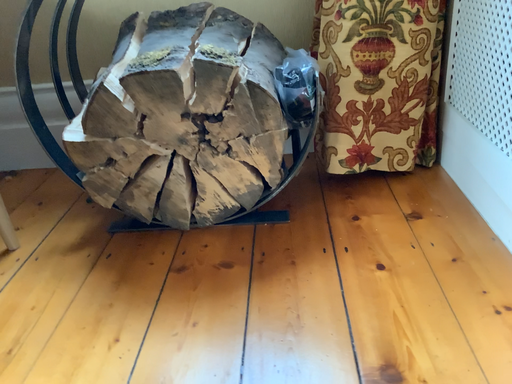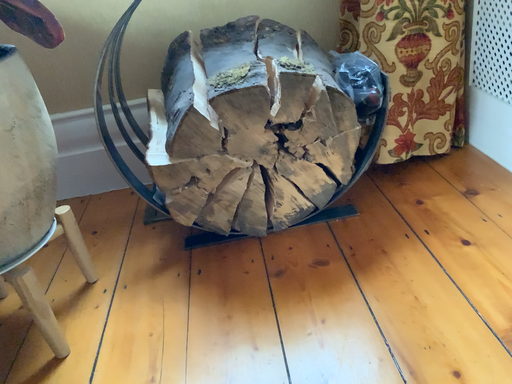
Question: Which way did the camera rotate in the video?

Choices:
 (A) rotated right
 (B) rotated left

Answer: (A)